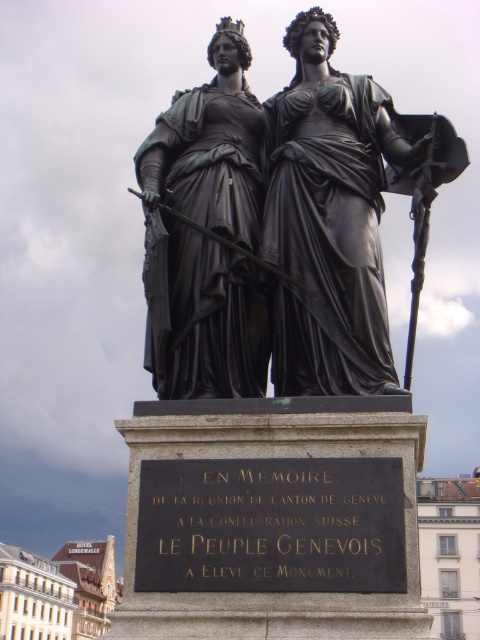
Looking at this image, what are the coordinates of the black polished statue at center?

The coordinates of the black polished statue at center are at point (328,218).

You are a tour guide explaining the statue to visitors. You mention both the matte black statue at center and the black metal plaque at center. A visitor asks, which one is taller? Please answer based on the description provided.

The matte black statue at center is taller than the black metal plaque at center.

Based on the photo, what is the spatial relationship between the black polished statue at center and the black metal plaque at center in the image?

The black polished statue at center is to the right of the black metal plaque at center.